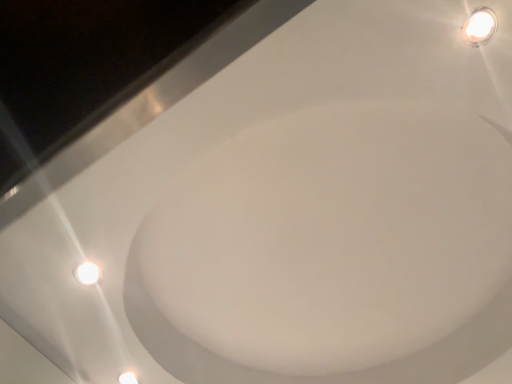
Question: Would you say white glossy bath at upper center is to the left or to the right of white glossy light fixture at upper right in the picture?

Choices:
 (A) left
 (B) right

Answer: (A)

Question: Is white glossy bath at upper center inside or outside of white glossy light fixture at upper right?

Choices:
 (A) outside
 (B) inside

Answer: (A)

Question: In terms of size, does white glossy bath at upper center appear bigger or smaller than white glossy light fixture at upper right?

Choices:
 (A) big
 (B) small

Answer: (A)

Question: In terms of width, does white glossy light fixture at upper right look wider or thinner when compared to white glossy bath at upper center?

Choices:
 (A) wide
 (B) thin

Answer: (B)

Question: Is white glossy light fixture at upper right in front of or behind white glossy bath at upper center in the image?

Choices:
 (A) behind
 (B) front

Answer: (B)

Question: Is white glossy light fixture at upper right bigger or smaller than white glossy bath at upper center?

Choices:
 (A) small
 (B) big

Answer: (A)

Question: Is point (492, 34) closer or farther from the camera than point (172, 304)?

Choices:
 (A) closer
 (B) farther

Answer: (A)